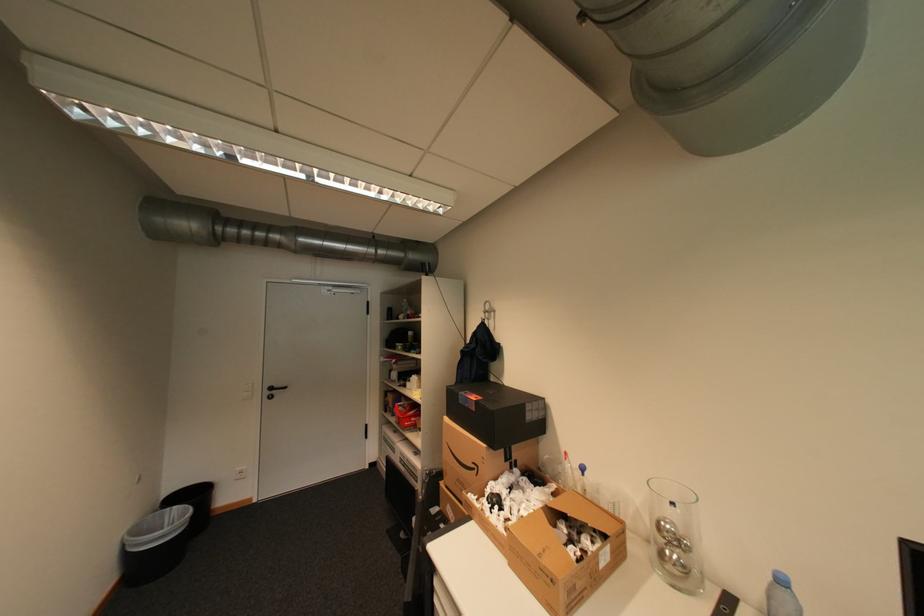
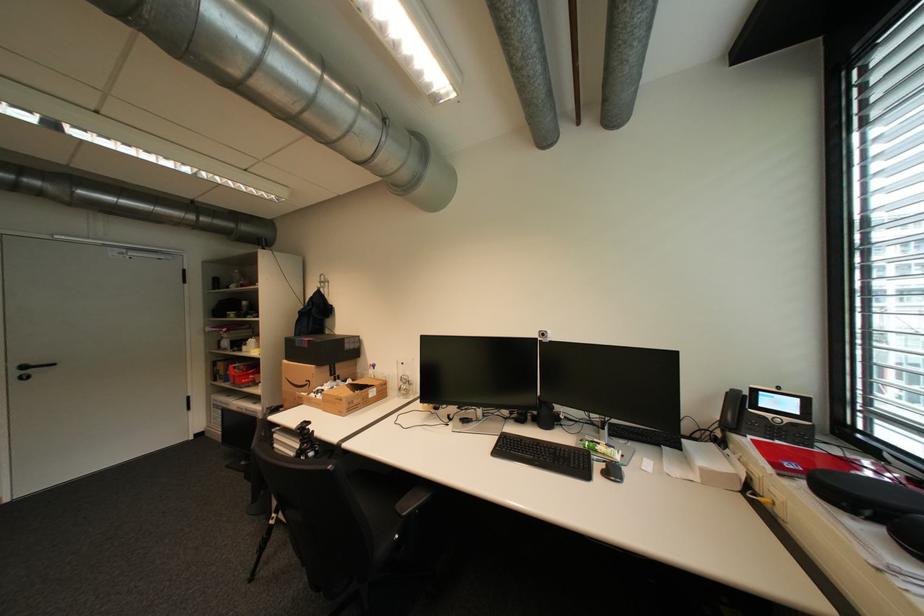
Locate, in the second image, the point that corresponds to pixel 469 352 in the first image.

(308, 312)